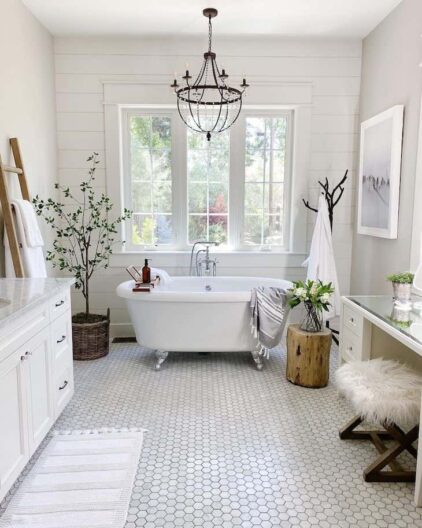
Find the location of a particular element. Image resolution: width=422 pixels, height=528 pixels. wood tree trunk table is located at coordinates (302, 363).